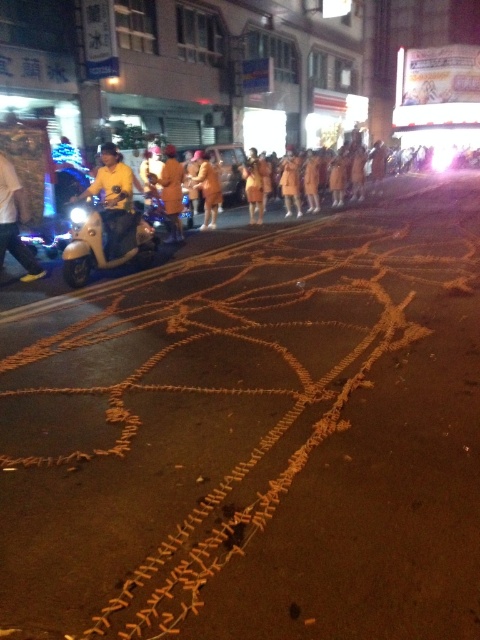
Is matte silver scooter at left above orange fabric at center?

No, matte silver scooter at left is not above orange fabric at center.

Is matte silver scooter at left to the right of orange fabric at center from the viewer's perspective?

Incorrect, matte silver scooter at left is not on the right side of orange fabric at center.

The image size is (480, 640). Find the location of `matte silver scooter at left`. matte silver scooter at left is located at coordinates (106, 241).

At what (x,y) coordinates should I click in order to perform the action: click on matte silver scooter at left. Please return your answer as a coordinate pair (x, y). Looking at the image, I should click on (106, 241).

Is yellow matte scooter at left wider than yellow fabric person at left?

Correct, the width of yellow matte scooter at left exceeds that of yellow fabric person at left.

Between point (118, 196) and point (3, 205), which one is positioned behind?

The point (118, 196) is more distant.

At what (x,y) coordinates should I click in order to perform the action: click on yellow matte scooter at left. Please return your answer as a coordinate pair (x, y). Looking at the image, I should click on (113, 196).

Is the position of yellow matte scooter at left less distant than that of yellow matte uniform at center?

Yes, yellow matte scooter at left is in front of yellow matte uniform at center.

Can you confirm if yellow matte scooter at left is bigger than yellow matte uniform at center?

No, yellow matte scooter at left is not bigger than yellow matte uniform at center.

The width and height of the screenshot is (480, 640). Describe the element at coordinates (113, 196) in the screenshot. I see `yellow matte scooter at left` at that location.

Find the location of a particular element. The image size is (480, 640). yellow matte scooter at left is located at coordinates tap(113, 196).